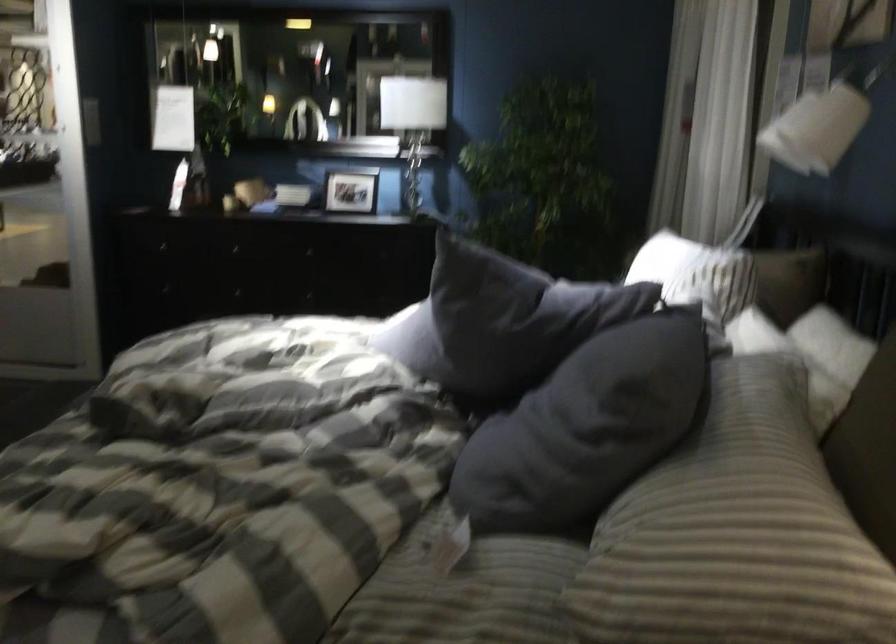
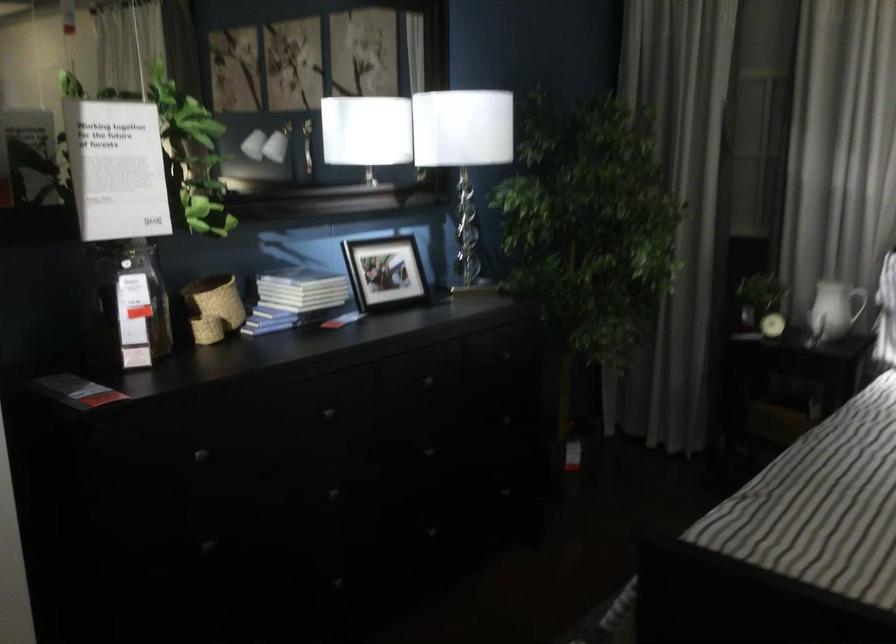
The point at (352, 163) is marked in the first image. Where is the corresponding point in the second image?

(384, 272)